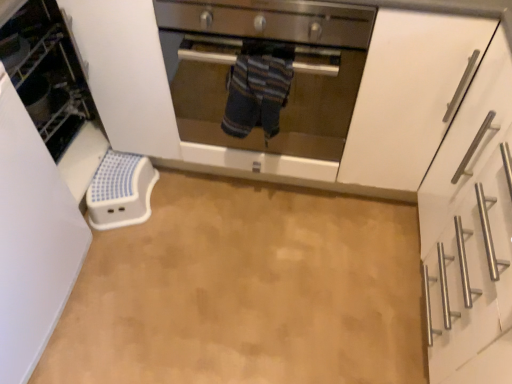
Find the location of a particular element. Image resolution: width=512 pixels, height=384 pixels. striped fabric towel at center is located at coordinates (258, 88).

In order to click on white plastic step stool at left in this screenshot , I will do `click(53, 88)`.

Find the location of `striped fabric towel at center`. striped fabric towel at center is located at coordinates (258, 88).

Which of these two, white matte cabinet at right or stainless steel oven at center, is thinner?

stainless steel oven at center is thinner.

Is white matte cabinet at right directly adjacent to stainless steel oven at center?

No, white matte cabinet at right is not with stainless steel oven at center.

From a real-world perspective, is white matte cabinet at right beneath stainless steel oven at center?

Yes.

Is white matte cabinet at right positioned with its back to stainless steel oven at center?

That's not correct — white matte cabinet at right is not looking away from stainless steel oven at center.

Measure the distance from white matte cabinet at right to striped fabric towel at center.

white matte cabinet at right and striped fabric towel at center are 13.71 inches apart from each other.

Would you say white matte cabinet at right is outside striped fabric towel at center?

white matte cabinet at right is positioned outside striped fabric towel at center.

From a real-world perspective, is white matte cabinet at right under striped fabric towel at center?

Yes, from a real-world perspective, white matte cabinet at right is below striped fabric towel at center.

Who is bigger, white matte cabinet at right or striped fabric towel at center?

Bigger between the two is white matte cabinet at right.

In the scene shown: Considering the relative sizes of white plastic step stool at left and white matte cabinet at right in the image provided, is white plastic step stool at left shorter than white matte cabinet at right?

Incorrect, the height of white plastic step stool at left does not fall short of that of white matte cabinet at right.

Are white plastic step stool at left and white matte cabinet at right making contact?

No, white plastic step stool at left is not in contact with white matte cabinet at right.

Is white plastic step stool at left not within white matte cabinet at right?

Yes, white plastic step stool at left is located beyond the bounds of white matte cabinet at right.

Is white plastic step stool at left closer to the viewer compared to white matte cabinet at right?

No, white plastic step stool at left is further to the viewer.

Looking at this image, which object is wider, striped fabric towel at center or white matte cabinet at right?

white matte cabinet at right is wider.

Can white matte cabinet at right be found inside striped fabric towel at center?

No, white matte cabinet at right is located outside of striped fabric towel at center.

Considering the relative sizes of striped fabric towel at center and white matte cabinet at right in the image provided, is striped fabric towel at center shorter than white matte cabinet at right?

Yes, striped fabric towel at center is shorter than white matte cabinet at right.

Considering the positions of objects striped fabric towel at center and white matte cabinet at right in the image provided, who is more to the right, striped fabric towel at center or white matte cabinet at right?

white matte cabinet at right is more to the right.

Would you say white plastic step stool at left is inside or outside beige vinyl floor at center?

white plastic step stool at left exists outside the volume of beige vinyl floor at center.

From the image's perspective, which is below, white plastic step stool at left or beige vinyl floor at center?

beige vinyl floor at center.

Is white plastic step stool at left turned away from beige vinyl floor at center?

No, white plastic step stool at left is not facing away from beige vinyl floor at center.

Is point (478, 36) closer or farther from the camera than point (70, 62)?

Point (478, 36).

Is white matte cabinet at right outside of white plastic step stool at left?

Yes.

Between white matte cabinet at right and white plastic step stool at left, which one has smaller width?

white plastic step stool at left.

From a real-world perspective, is white matte cabinet at right on white plastic step stool at left?

Yes, from a real-world perspective, white matte cabinet at right is over white plastic step stool at left

Can you confirm if stainless steel oven at center is bigger than white plastic step stool at left?

Correct, stainless steel oven at center is larger in size than white plastic step stool at left.

From a real-world perspective, is stainless steel oven at center located beneath white plastic step stool at left?

No, from a real-world perspective, stainless steel oven at center is not below white plastic step stool at left.

Based on the photo, relative to white plastic step stool at left, is stainless steel oven at center in front or behind?

In the image, stainless steel oven at center appears behind white plastic step stool at left.

The width and height of the screenshot is (512, 384). Identify the location of oven behind the white plastic step stool at left. (265, 71).

Identify the location of cabinetry below the stainless steel oven at center (from a real-world perspective). This screenshot has width=512, height=384. (407, 95).

In order to click on cabinetry that is on the right side of striped fabric towel at center in this screenshot , I will do `click(407, 95)`.

Estimate the real-world distances between objects in this image. Which object is further from white matte cabinet at right, striped fabric towel at center or beige vinyl floor at center?

beige vinyl floor at center is further to white matte cabinet at right.

Looking at the image, which one is located further to white matte cabinet at right, beige vinyl floor at center or stainless steel oven at center?

beige vinyl floor at center lies further to white matte cabinet at right than the other object.

Considering their positions, is striped fabric towel at center positioned further to stainless steel oven at center than white matte cabinet at right?

Among the two, white matte cabinet at right is located further to stainless steel oven at center.

Looking at the image, which one is located further to beige vinyl floor at center, stainless steel oven at center or striped fabric towel at center?

Based on the image, striped fabric towel at center appears to be further to beige vinyl floor at center.

Estimate the real-world distances between objects in this image. Which object is closer to beige vinyl floor at center, stainless steel oven at center or white plastic step stool at left?

The object closer to beige vinyl floor at center is stainless steel oven at center.

Considering their positions, is striped fabric towel at center positioned closer to beige vinyl floor at center than stainless steel oven at center?

stainless steel oven at center.

Which object lies further to the anchor point striped fabric towel at center, stainless steel oven at center or white matte cabinet at right?

white matte cabinet at right is further to striped fabric towel at center.

Looking at the image, which one is located further to stainless steel oven at center, white matte cabinet at right or white plastic step stool at left?

white plastic step stool at left lies further to stainless steel oven at center than the other object.

Find the location of a particular element. The image size is (512, 384). person situated between white plastic step stool at left and white matte cabinet at right from left to right is located at coordinates (258, 88).

The height and width of the screenshot is (384, 512). I want to click on oven situated between striped fabric towel at center and white matte cabinet at right from left to right, so click(265, 71).

Locate an element on the screen. person between stainless steel oven at center and beige vinyl floor at center in the vertical direction is located at coordinates (258, 88).

The width and height of the screenshot is (512, 384). Identify the location of person situated between white plastic step stool at left and stainless steel oven at center from left to right. (258, 88).